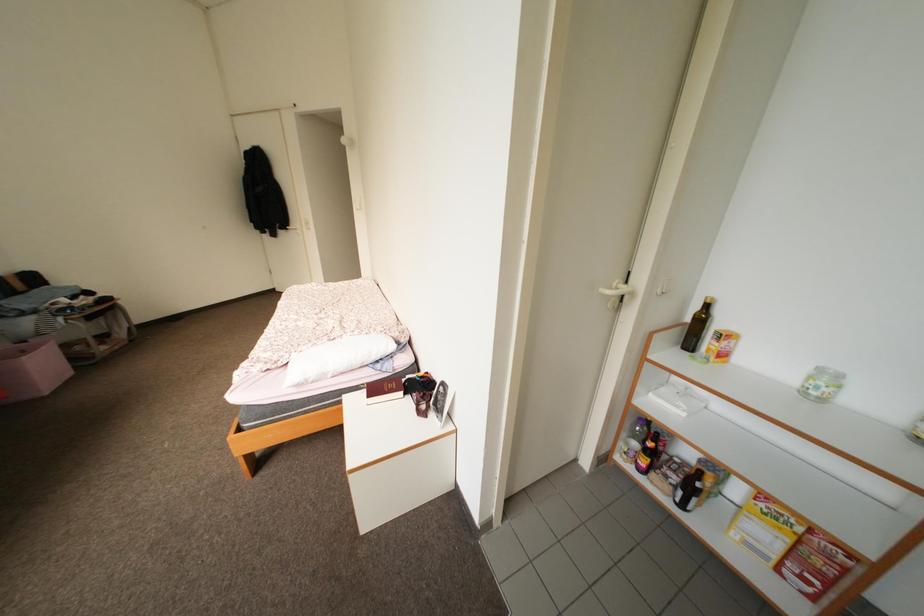
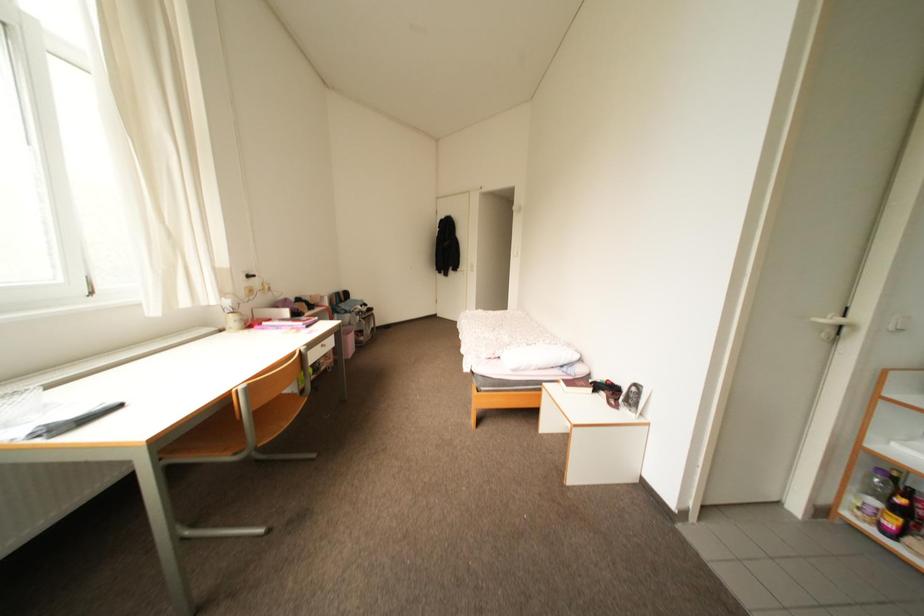
Question: The first image is from the beginning of the video and the second image is from the end. How did the camera likely rotate when shooting the video?

Choices:
 (A) Left
 (B) Right
 (C) Up
 (D) Down

Answer: (A)